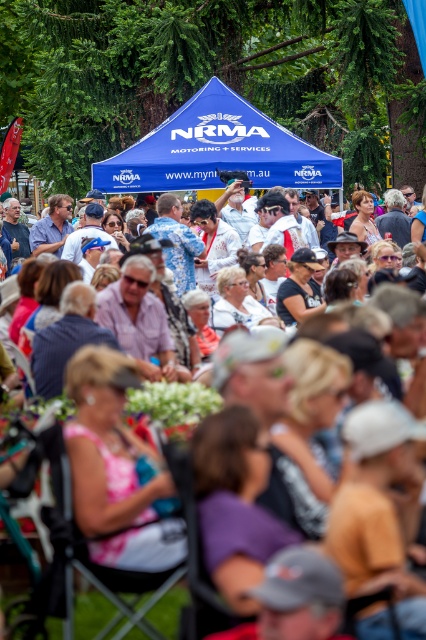
Question: Which point is closer to the camera?

Choices:
 (A) blue fabric canopy at center
 (B) matte white shirts at center

Answer: (B)

Question: Does blue fabric canopy at center have a greater width compared to matte white shirts at center?

Choices:
 (A) no
 (B) yes

Answer: (B)

Question: Is blue fabric canopy at center to the right of matte white shirts at center from the viewer's perspective?

Choices:
 (A) no
 (B) yes

Answer: (B)

Question: Is blue fabric canopy at center bigger than matte white shirts at center?

Choices:
 (A) yes
 (B) no

Answer: (A)